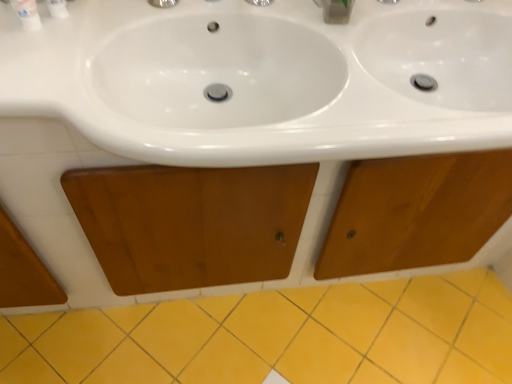
This screenshot has height=384, width=512. What do you see at coordinates (139, 164) in the screenshot? I see `wooden cabinet at center` at bounding box center [139, 164].

What is the approximate height of wooden cabinet at center?

wooden cabinet at center is 33.21 inches tall.

You are a GUI agent. You are given a task and a screenshot of the screen. Output one action in this format:
    pyautogui.click(x=<x>, y=<y>)
    Task: Click on the white plastic toothpaste tube at upper left
    The height and width of the screenshot is (384, 512).
    Given the screenshot: What is the action you would take?
    pyautogui.click(x=57, y=8)

Are yellow ceramic tile at lower center and white plastic toothpaste tube at upper left located far from each other?

Indeed, yellow ceramic tile at lower center is not near white plastic toothpaste tube at upper left.

Is yellow ceramic tile at lower center to the left of white plastic toothpaste tube at upper left from the viewer's perspective?

Incorrect, yellow ceramic tile at lower center is not on the left side of white plastic toothpaste tube at upper left.

From the image's perspective, is yellow ceramic tile at lower center below white plastic toothpaste tube at upper left?

Yes, from the image's perspective, yellow ceramic tile at lower center is beneath white plastic toothpaste tube at upper left.

Is yellow ceramic tile at lower center in front of or behind white plastic toothpaste tube at upper left in the image?

yellow ceramic tile at lower center is behind white plastic toothpaste tube at upper left.

Do you think white plastic toothpaste tube at upper left is within wooden cabinet at center, or outside of it?

white plastic toothpaste tube at upper left exists outside the volume of wooden cabinet at center.

Considering the relative positions of white plastic toothpaste tube at upper left and wooden cabinet at center in the image provided, is white plastic toothpaste tube at upper left to the left of wooden cabinet at center from the viewer's perspective?

Correct, you'll find white plastic toothpaste tube at upper left to the left of wooden cabinet at center.

Locate an element on the screen. This screenshot has width=512, height=384. toiletry above the wooden cabinet at center (from the image's perspective) is located at coordinates (57, 8).

Is the depth of clear plastic container at upper center greater than that of white plastic toothpaste tube at upper left?

Yes, it is behind white plastic toothpaste tube at upper left.

Which of these two, clear plastic container at upper center or white plastic toothpaste tube at upper left, stands taller?

white plastic toothpaste tube at upper left.

Is clear plastic container at upper center bigger or smaller than white plastic toothpaste tube at upper left?

Considering their sizes, clear plastic container at upper center takes up more space than white plastic toothpaste tube at upper left.

Does white glossy bottle at upper left touch clear plastic container at upper center?

They are not placed beside each other.

Based on the photo, which of these two, white glossy bottle at upper left or clear plastic container at upper center, is bigger?

clear plastic container at upper center.

Could clear plastic container at upper center be considered to be inside white glossy bottle at upper left?

No, clear plastic container at upper center is not inside white glossy bottle at upper left.

Identify the location of plumbing fixture that is under the white glossy bottle at upper left (from a real-world perspective). This screenshot has width=512, height=384. (335, 10).

From their relative heights in the image, would you say white glossy bottle at upper left is taller or shorter than yellow ceramic tile at lower center?

Considering their sizes, white glossy bottle at upper left has more height than yellow ceramic tile at lower center.

From the image's perspective, is white glossy bottle at upper left located above or below yellow ceramic tile at lower center?

Based on their image positions, white glossy bottle at upper left is located above yellow ceramic tile at lower center.

In the scene shown: Considering the relative sizes of white glossy bottle at upper left and yellow ceramic tile at lower center in the image provided, is white glossy bottle at upper left wider than yellow ceramic tile at lower center?

No, white glossy bottle at upper left is not wider than yellow ceramic tile at lower center.

Is white glossy bottle at upper left surrounding yellow ceramic tile at lower center?

No, yellow ceramic tile at lower center is not surrounded by white glossy bottle at upper left.

Can you confirm if white plastic toothpaste tube at upper left is smaller than clear plastic container at upper center?

Yes.

Are white plastic toothpaste tube at upper left and clear plastic container at upper center located far from each other?

Actually, white plastic toothpaste tube at upper left and clear plastic container at upper center are a little close together.

Is white plastic toothpaste tube at upper left facing towards clear plastic container at upper center?

No, white plastic toothpaste tube at upper left does not turn towards clear plastic container at upper center.

Is white plastic toothpaste tube at upper left wider or thinner than clear plastic container at upper center?

white plastic toothpaste tube at upper left is thinner than clear plastic container at upper center.

Considering the relative sizes of white glossy bottle at upper left and white plastic toothpaste tube at upper left in the image provided, is white glossy bottle at upper left bigger than white plastic toothpaste tube at upper left?

Yes, white glossy bottle at upper left is bigger than white plastic toothpaste tube at upper left.

From the image's perspective, which one is positioned lower, white glossy bottle at upper left or white plastic toothpaste tube at upper left?

white glossy bottle at upper left, from the image's perspective.

Does white glossy bottle at upper left have a lesser height compared to white plastic toothpaste tube at upper left?

Indeed, white glossy bottle at upper left has a lesser height compared to white plastic toothpaste tube at upper left.

Does white glossy bottle at upper left contain white plastic toothpaste tube at upper left?

Definitely not — white plastic toothpaste tube at upper left is not inside white glossy bottle at upper left.

You are a GUI agent. You are given a task and a screenshot of the screen. Output one action in this format:
    pyautogui.click(x=<x>, y=<y>)
    Task: Click on the ceramic tile on the right side of white plastic toothpaste tube at upper left
    This screenshot has height=384, width=512.
    Given the screenshot: What is the action you would take?
    pyautogui.click(x=278, y=336)

At what (x,y) coordinates should I click in order to perform the action: click on toiletry on the left side of wooden cabinet at center. Please return your answer as a coordinate pair (x, y). The image size is (512, 384). Looking at the image, I should click on (57, 8).

Considering their positions, is white plastic toothpaste tube at upper left positioned further to yellow ceramic tile at lower center than wooden cabinet at center?

Based on the image, white plastic toothpaste tube at upper left appears to be further to yellow ceramic tile at lower center.

In the scene shown: Which object lies further to the anchor point yellow ceramic tile at lower center, clear plastic container at upper center or white glossy bottle at upper left?

white glossy bottle at upper left.

Based on their spatial positions, is white glossy bottle at upper left or wooden cabinet at center closer to yellow ceramic tile at lower center?

wooden cabinet at center is closer to yellow ceramic tile at lower center.

From the image, which object appears to be nearer to white glossy bottle at upper left, clear plastic container at upper center or white plastic toothpaste tube at upper left?

white plastic toothpaste tube at upper left.

Looking at the image, which one is located further to wooden cabinet at center, clear plastic container at upper center or white plastic toothpaste tube at upper left?

clear plastic container at upper center.

From the image, which object appears to be farther from white plastic toothpaste tube at upper left, white glossy bottle at upper left or yellow ceramic tile at lower center?

yellow ceramic tile at lower center lies further to white plastic toothpaste tube at upper left than the other object.

Based on the photo, which object lies nearer to the anchor point clear plastic container at upper center, white plastic toothpaste tube at upper left or wooden cabinet at center?

The object closer to clear plastic container at upper center is white plastic toothpaste tube at upper left.

When comparing their distances from white plastic toothpaste tube at upper left, does yellow ceramic tile at lower center or white glossy bottle at upper left seem further?

Among the two, yellow ceramic tile at lower center is located further to white plastic toothpaste tube at upper left.

At what (x,y) coordinates should I click in order to perform the action: click on cabinetry between white glossy bottle at upper left and yellow ceramic tile at lower center vertically. Please return your answer as a coordinate pair (x, y). Looking at the image, I should click on (139, 164).

The image size is (512, 384). I want to click on cabinetry between white plastic toothpaste tube at upper left and yellow ceramic tile at lower center from top to bottom, so click(139, 164).

This screenshot has width=512, height=384. What are the coordinates of `cabinetry between white plastic toothpaste tube at upper left and clear plastic container at upper center from left to right` in the screenshot? It's located at (139, 164).

I want to click on cabinetry that lies between clear plastic container at upper center and yellow ceramic tile at lower center from top to bottom, so click(x=139, y=164).